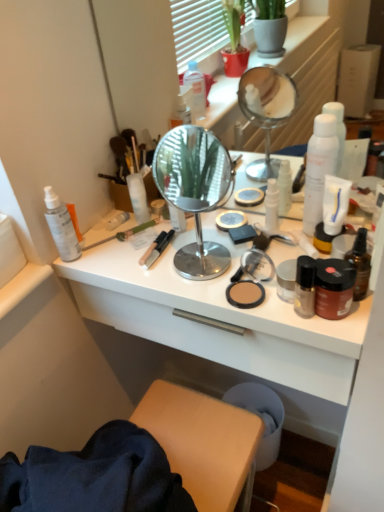
At what (x,y) coordinates should I click in order to perform the action: click on vacant space to the left of white matte spray can at right, which is the first bottle from top to bottom. Please return your answer as a coordinate pair (x, y). This screenshot has height=512, width=384. Looking at the image, I should click on (233, 239).